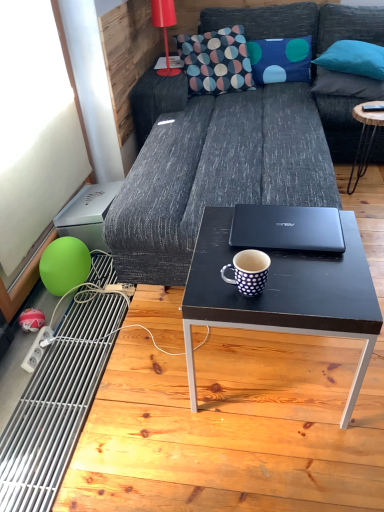
At what (x,y) coordinates should I click in order to perform the action: click on unoccupied space behind white dotted ceramic mug at center. Please return your answer as a coordinate pair (x, y). The width and height of the screenshot is (384, 512). Looking at the image, I should click on (222, 253).